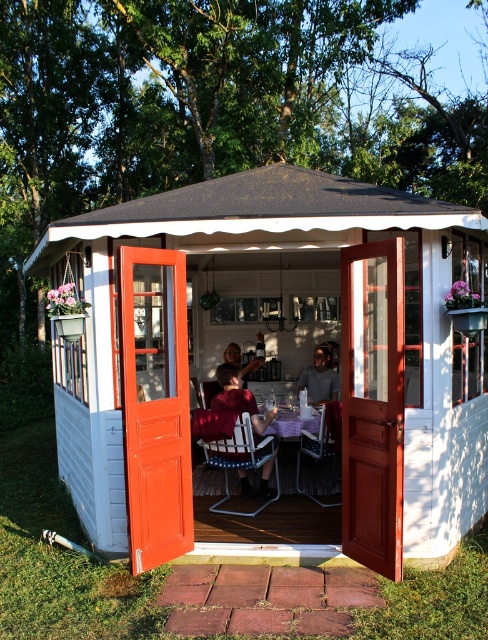
Does matte red shirt at center have a greater height compared to matte black shirt at center?

Yes, matte red shirt at center is taller than matte black shirt at center.

Is point (234, 369) positioned after point (264, 346)?

No, (234, 369) is closer to viewer.

Which is in front, point (273, 412) or point (237, 364)?

Point (273, 412)

I want to click on matte red shirt at center, so click(x=228, y=406).

Is white wood gazebo at center taller than purple fabric picnic table at center?

Yes.

Does point (134, 364) lie in front of point (334, 401)?

Yes, it is.

At what (x,y) coordinates should I click in order to perform the action: click on white wood gazebo at center. Please return your answer as a coordinate pair (x, y). The image size is (488, 640). Looking at the image, I should click on (273, 356).

From the picture: Does white wood gazebo at center lie in front of matte black shirt at center?

Yes, it is in front of matte black shirt at center.

Is white wood gazebo at center above matte black shirt at center?

Correct, white wood gazebo at center is located above matte black shirt at center.

Image resolution: width=488 pixels, height=640 pixels. I want to click on white wood gazebo at center, so click(x=273, y=356).

At what (x,y) coordinates should I click in order to perform the action: click on white wood gazebo at center. Please return your answer as a coordinate pair (x, y). The height and width of the screenshot is (640, 488). Looking at the image, I should click on (273, 356).